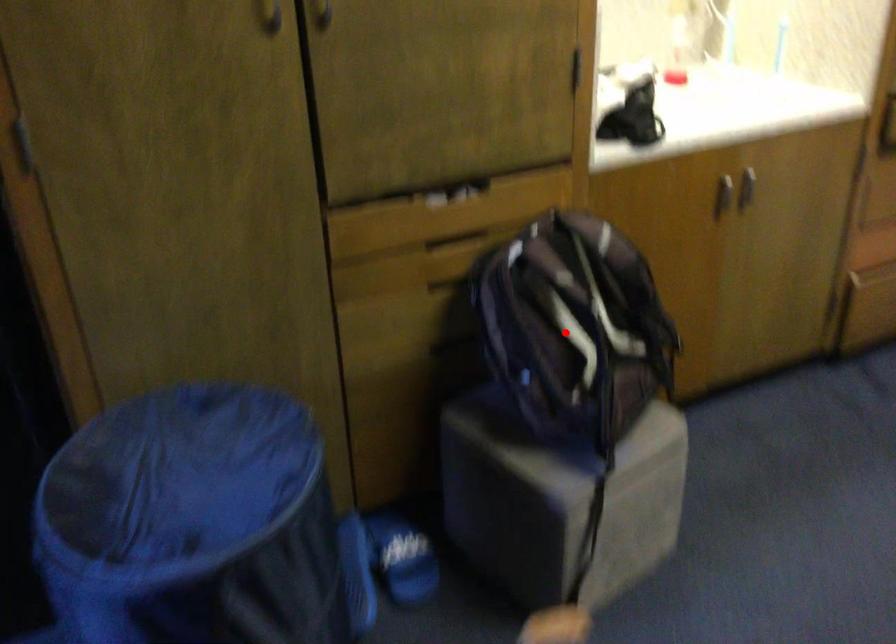
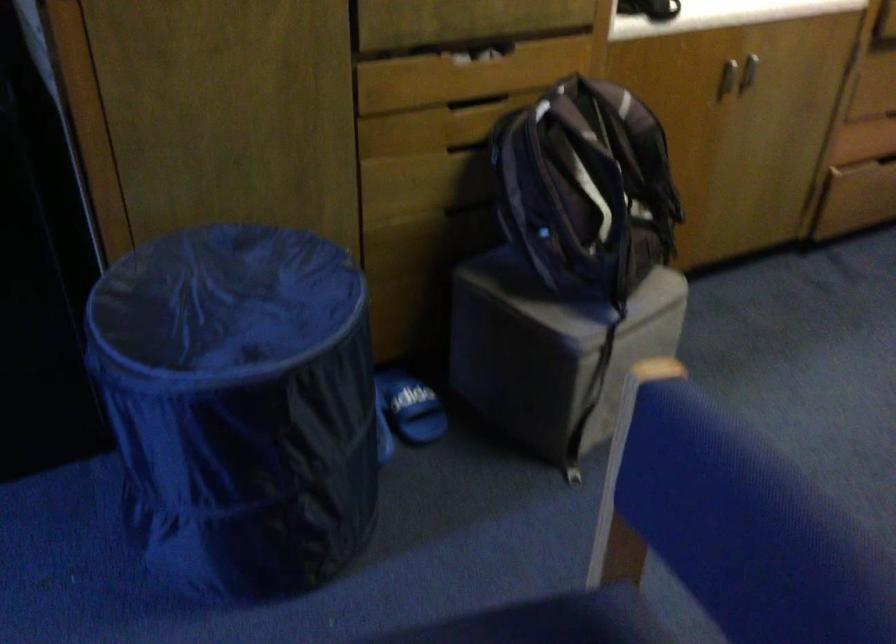
Question: I am providing you with two images of the same scene from different viewpoints. A red point is marked on the first image. Is the red point's position out of view in image 2?

Choices:
 (A) Yes
 (B) No

Answer: (B)